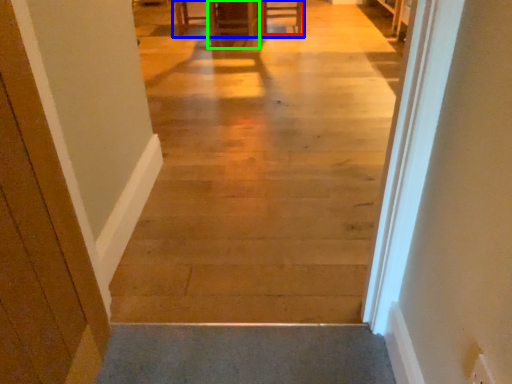
Question: Which object is the farthest from furniture (highlighted by a red box)? Choose among these: table (highlighted by a blue box) or furniture (highlighted by a green box).

Choices:
 (A) table
 (B) furniture

Answer: (A)